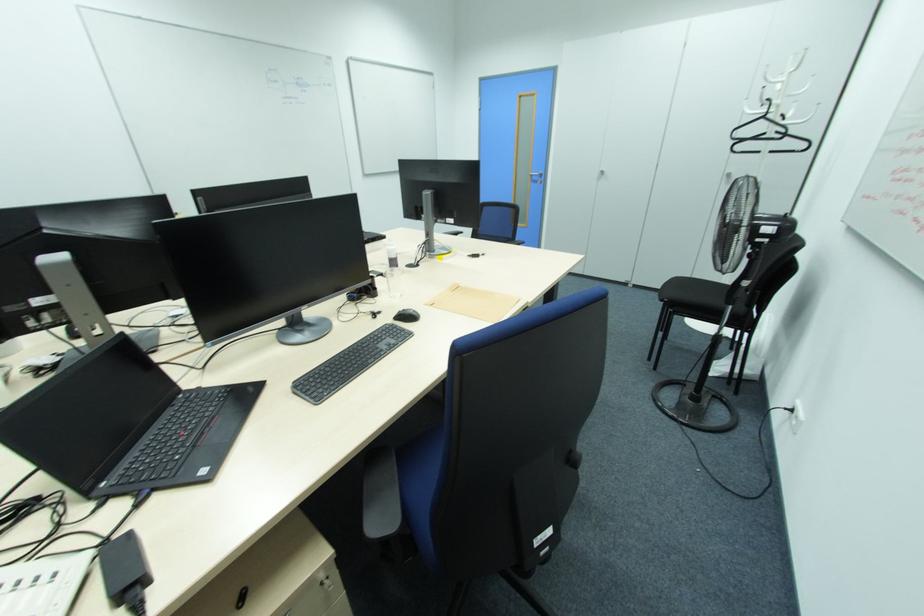
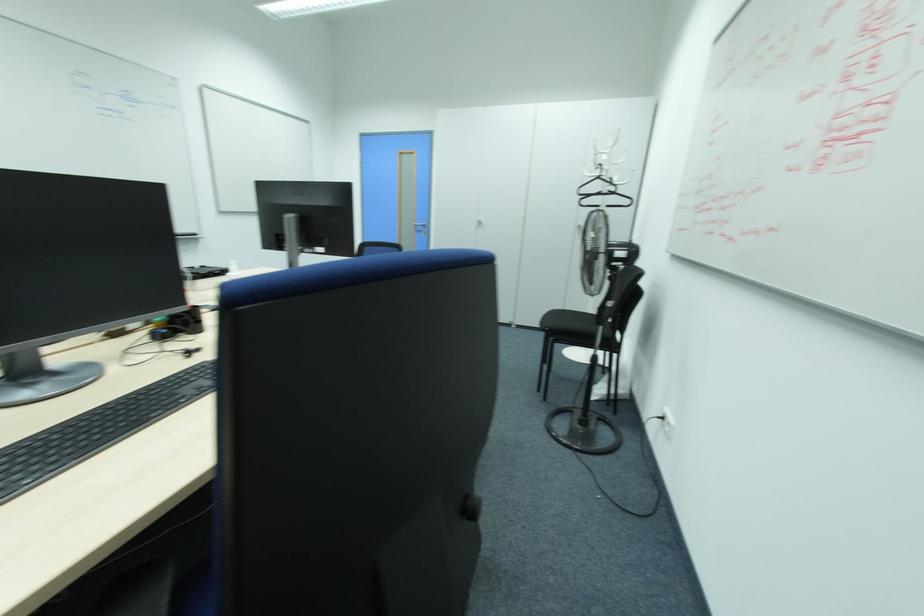
The images are taken continuously from a first-person perspective. In which direction are you moving?

The cameraman walked toward right, forward.